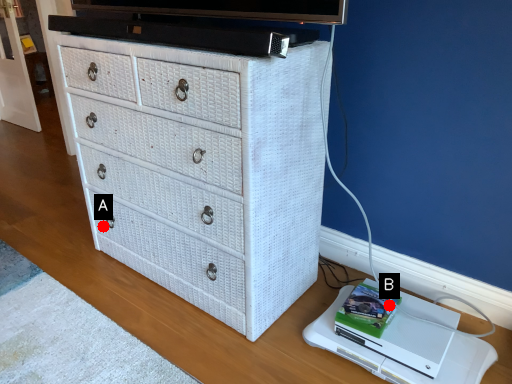
Question: Two points are circled on the image, labeled by A and B beside each circle. Which of the following is the closest to the observer?

Choices:
 (A) A is closer
 (B) B is closer

Answer: (B)